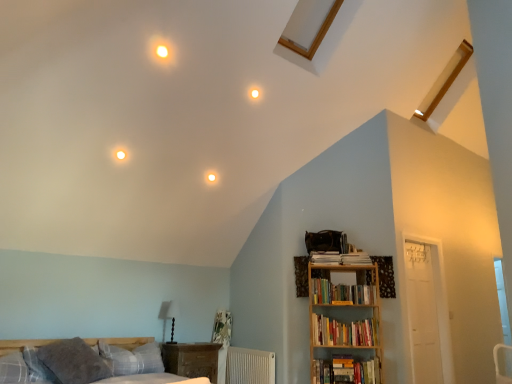
Question: Is white textured radiator at lower center to the right of plaid fabric pillow at lower left, the second pillow viewed from the right, from the viewer's perspective?

Choices:
 (A) yes
 (B) no

Answer: (A)

Question: Considering the relative positions of white textured radiator at lower center and plaid fabric pillow at lower left, which is the first pillow in left-to-right order, in the image provided, is white textured radiator at lower center to the left of plaid fabric pillow at lower left, which is the first pillow in left-to-right order, from the viewer's perspective?

Choices:
 (A) no
 (B) yes

Answer: (A)

Question: Can you confirm if white textured radiator at lower center is thinner than plaid fabric pillow at lower left, which is the first pillow in left-to-right order?

Choices:
 (A) yes
 (B) no

Answer: (A)

Question: Does white textured radiator at lower center lie in front of plaid fabric pillow at lower left, which is the first pillow in left-to-right order?

Choices:
 (A) yes
 (B) no

Answer: (B)

Question: Is white textured radiator at lower center not within plaid fabric pillow at lower left, which is the first pillow in left-to-right order?

Choices:
 (A) yes
 (B) no

Answer: (A)

Question: Which is correct: wooden bookshelf at right is inside hardcover books at right, which is the 2th book in bottom-to-top order, or outside of it?

Choices:
 (A) inside
 (B) outside

Answer: (B)

Question: From their relative heights in the image, would you say wooden bookshelf at right is taller or shorter than hardcover books at right, marked as the second book in a top-to-bottom arrangement?

Choices:
 (A) tall
 (B) short

Answer: (A)

Question: Relative to hardcover books at right, which is the 2th book in bottom-to-top order, is wooden bookshelf at right in front or behind?

Choices:
 (A) behind
 (B) front

Answer: (B)

Question: Is point (323, 307) closer or farther from the camera than point (360, 321)?

Choices:
 (A) farther
 (B) closer

Answer: (B)

Question: From the image's perspective, is white textured radiator at lower center located above or below plaid fabric bed at lower left?

Choices:
 (A) above
 (B) below

Answer: (B)

Question: Considering the positions of white textured radiator at lower center and plaid fabric bed at lower left in the image, is white textured radiator at lower center taller or shorter than plaid fabric bed at lower left?

Choices:
 (A) short
 (B) tall

Answer: (A)

Question: Which is correct: white textured radiator at lower center is inside plaid fabric bed at lower left, or outside of it?

Choices:
 (A) inside
 (B) outside

Answer: (B)

Question: Is point [x=269, y=365] positioned closer to the camera than point [x=138, y=379]?

Choices:
 (A) closer
 (B) farther

Answer: (B)

Question: Considering their positions, is gray soft pillow at lower left, the first pillow when ordered from right to left, located in front of or behind hardcover books at right, the third book viewed from the top?

Choices:
 (A) front
 (B) behind

Answer: (A)

Question: Considering the positions of gray soft pillow at lower left, the first pillow when ordered from right to left, and hardcover books at right, the third book viewed from the top, in the image, is gray soft pillow at lower left, the first pillow when ordered from right to left, taller or shorter than hardcover books at right, the third book viewed from the top,?

Choices:
 (A) short
 (B) tall

Answer: (A)